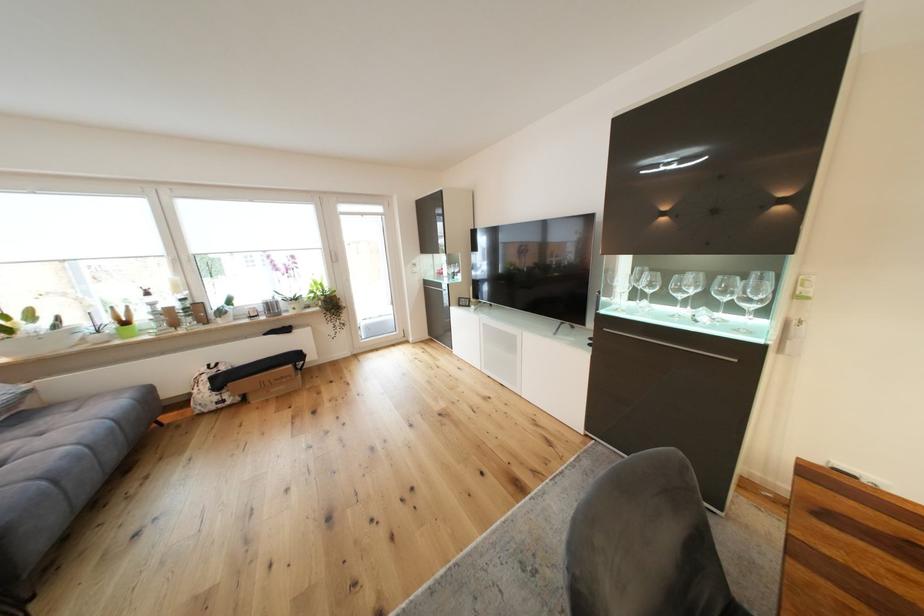
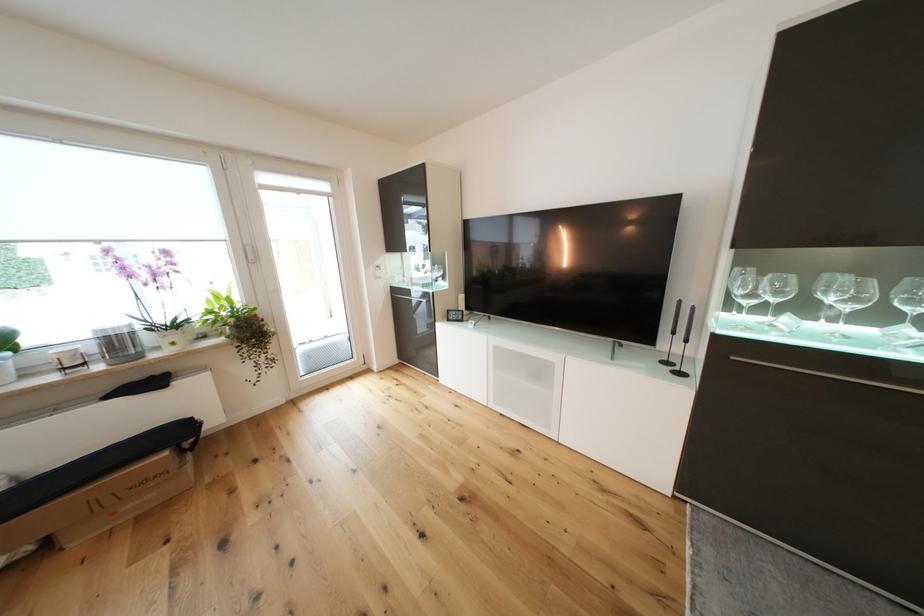
In the second image, find the point that corresponds to point (302, 360) in the first image.

(186, 435)